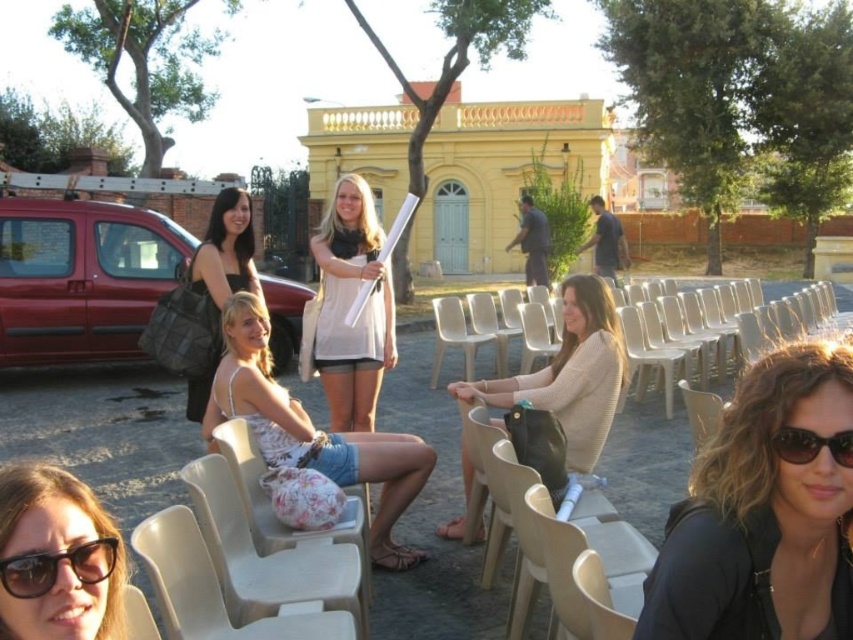
Question: Which object is positioned farthest from the dark brown hair at center?

Choices:
 (A) beige plastic chair at center
 (B) denim shorts at center

Answer: (A)

Question: Which point is farther to the camera?

Choices:
 (A) (834, 436)
 (B) (265, 417)
 (C) (453, 332)

Answer: (C)

Question: Is dark brown hair at center positioned behind beige plastic chair at center?

Choices:
 (A) yes
 (B) no

Answer: (B)

Question: Which of the following is the farthest from the observer?

Choices:
 (A) matte black dress at center
 (B) denim shorts at center

Answer: (A)

Question: Can you confirm if denim shorts at center is positioned below beige plastic chair at lower center?

Choices:
 (A) no
 (B) yes

Answer: (A)

Question: Does matte black dress at center have a smaller size compared to black plastic sunglasses at lower left?

Choices:
 (A) no
 (B) yes

Answer: (A)